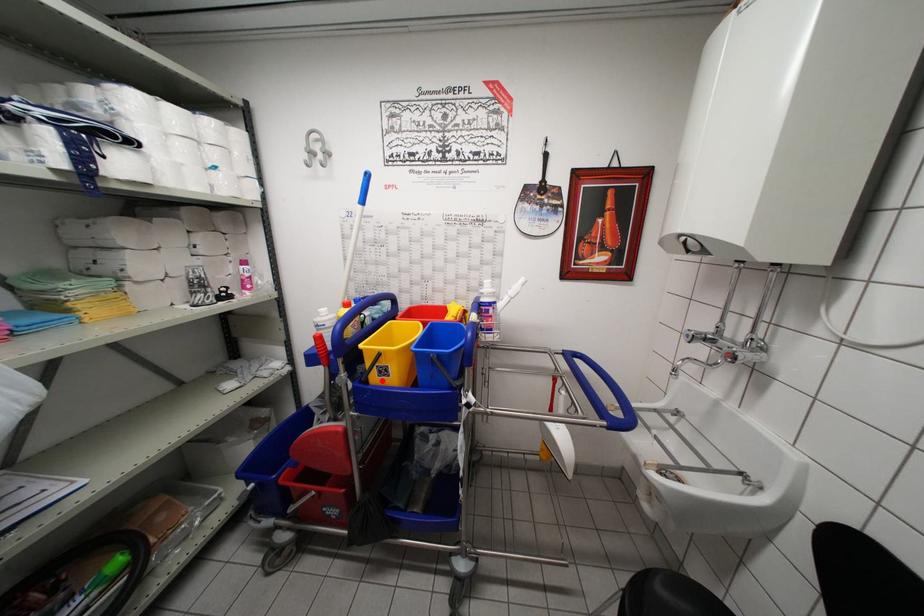
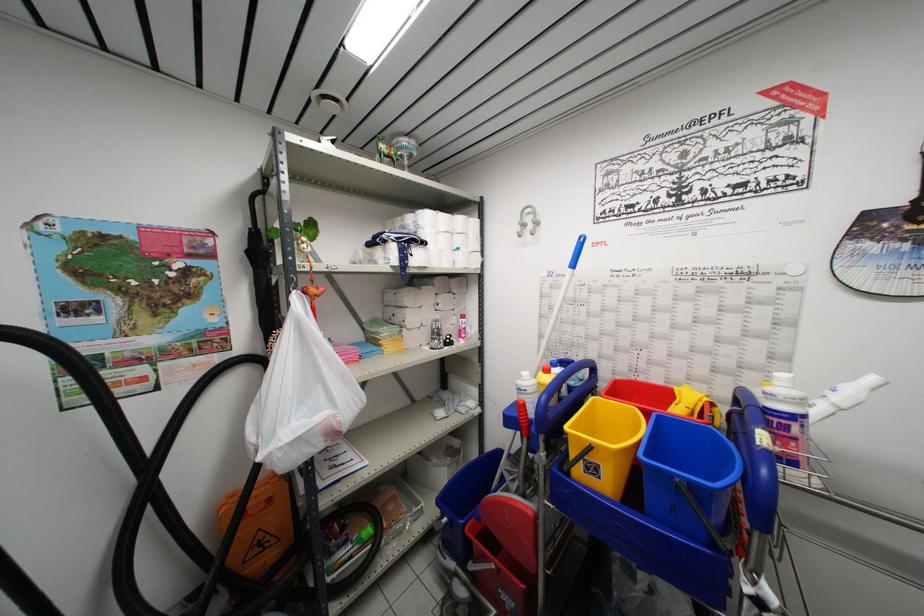
Locate, in the second image, the point that corresponds to the highlighted location in the first image.

(589, 477)